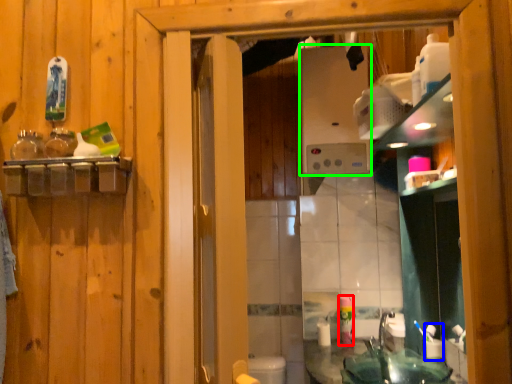
Question: Estimate the real-world distances between objects in this image. Which object is closer to mouthwash (highlighted by a red box), toiletry (highlighted by a blue box) or appliance (highlighted by a green box)?

Choices:
 (A) toiletry
 (B) appliance

Answer: (A)